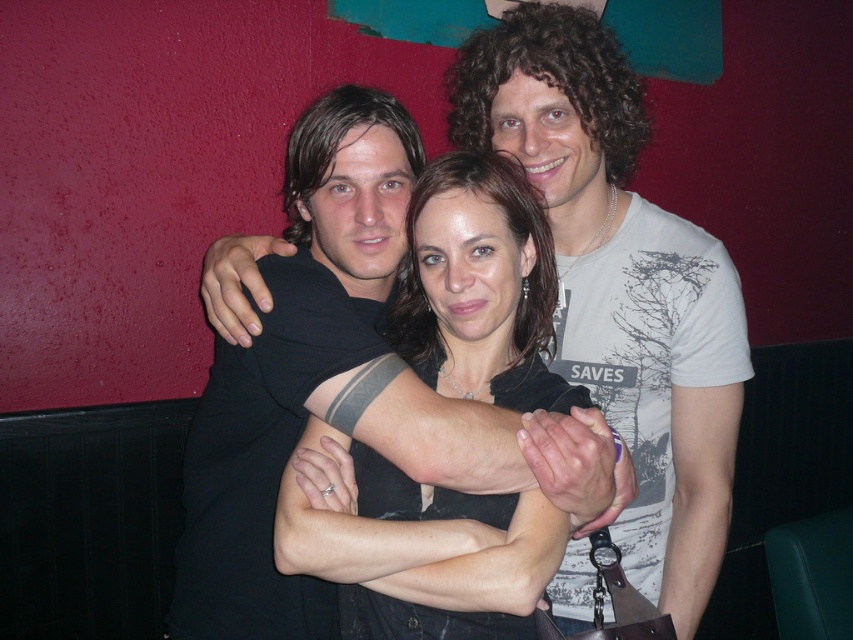
You are trying to identify the clothing of two people standing in the image. There is a black matte shirt at center and a matte black shirt at center. Which one is on the right side?

The black matte shirt at center is positioned on the right side of matte black shirt at center.

You are taking a photo of two points in the image. The first point is at coordinate point(453, 74) and the second point is at coordinate point(465, 333). Which point is closer to the camera?

Point(453, 74) is closer to the camera than point(465, 333).

You are trying to take a photo of the black matte shirt at center and the matte black shirt at center in the image. Which one is blocking the other from being fully visible?

The matte black shirt at center is behind the black matte shirt at center, so the black matte shirt at center is blocking the matte black shirt at center from being fully visible.